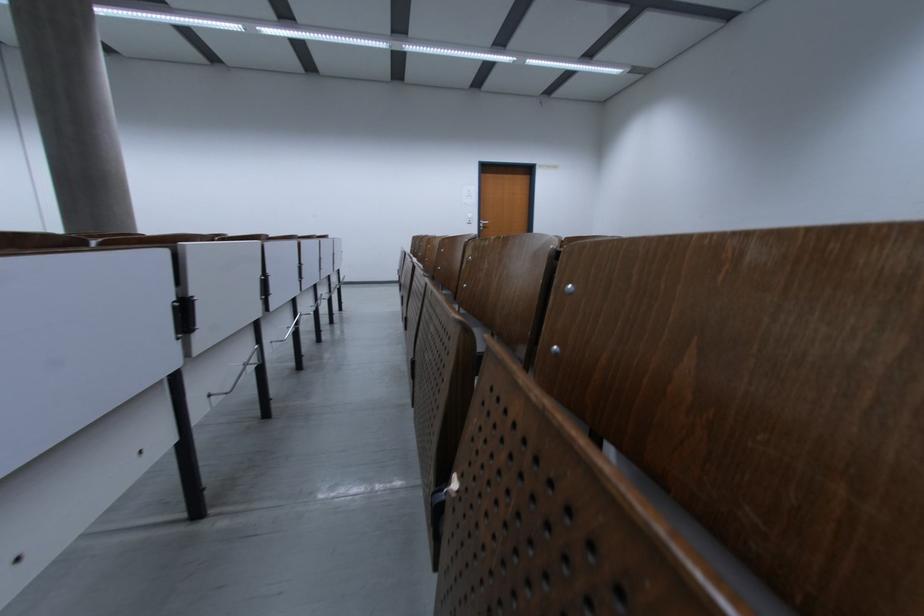
Where would you sit the wooden chair surface? Please return your answer as a coordinate pair (x, y).

(707, 337)